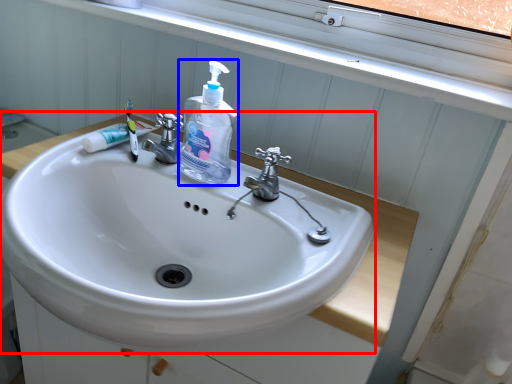
Question: Among these objects, which one is farthest to the camera, sink (highlighted by a red box) or cleaning product (highlighted by a blue box)?

Choices:
 (A) sink
 (B) cleaning product

Answer: (B)